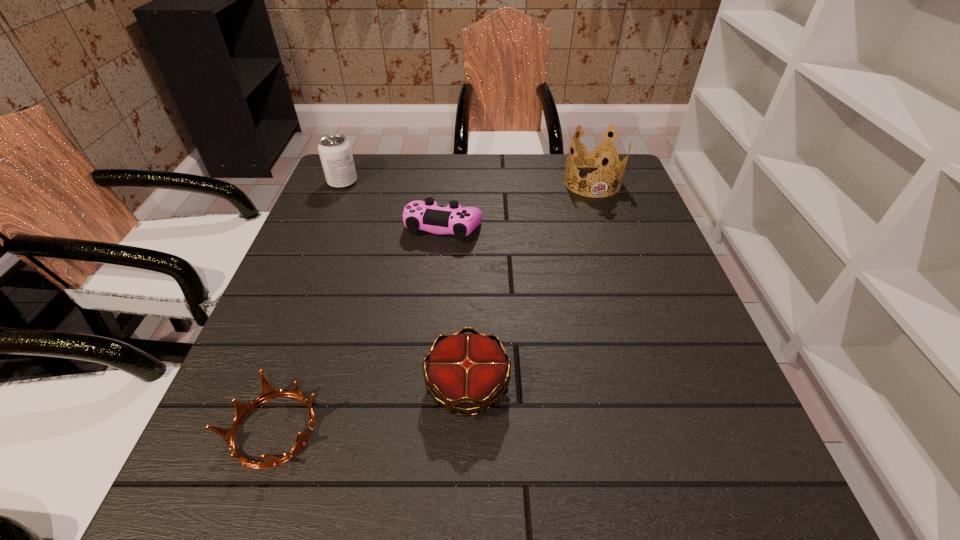
Identify the location of the farthest crown. (597, 155).

I want to click on the rightmost object, so click(597, 155).

Find the location of a particular element. The image size is (960, 540). soda can is located at coordinates (335, 152).

Identify the location of the second tallest crown. The height and width of the screenshot is (540, 960). (466, 372).

Find the location of a particular element. control is located at coordinates (426, 215).

This screenshot has height=540, width=960. I want to click on the shortest object, so click(268, 392).

Identify the location of the shortest crown. The image size is (960, 540). (268, 392).

Where is `vacant space situated 0.050m on the front of the tallest crown`? The image size is (960, 540). vacant space situated 0.050m on the front of the tallest crown is located at coordinates (601, 209).

Identify the location of blank space located 0.200m on the front of the soda can. (320, 237).

The width and height of the screenshot is (960, 540). I want to click on vacant space located 0.370m on the back of the second tallest crown, so click(471, 228).